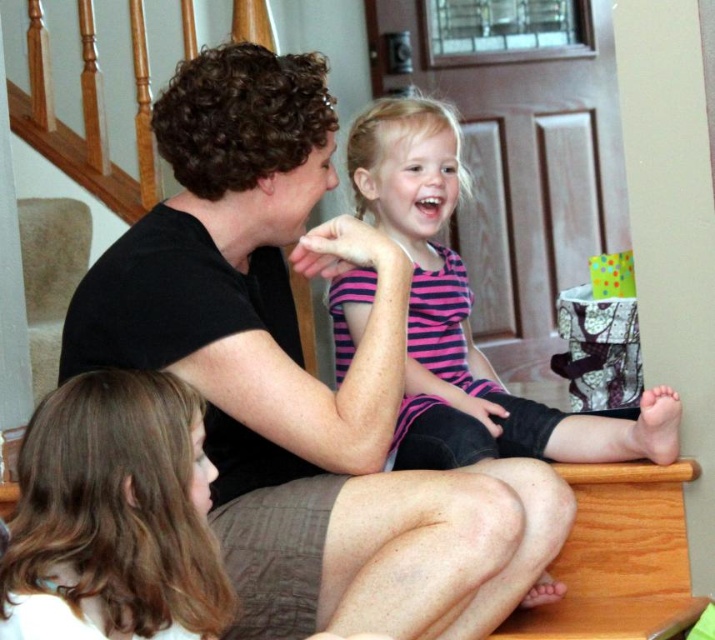
Is point (365, 460) farther from camera compared to point (473, 436)?

No, (365, 460) is closer to viewer.

Who is more forward, (225, 51) or (368, 298)?

Point (225, 51) is more forward.

Where is `black matte shirt at center`? This screenshot has width=715, height=640. black matte shirt at center is located at coordinates (300, 358).